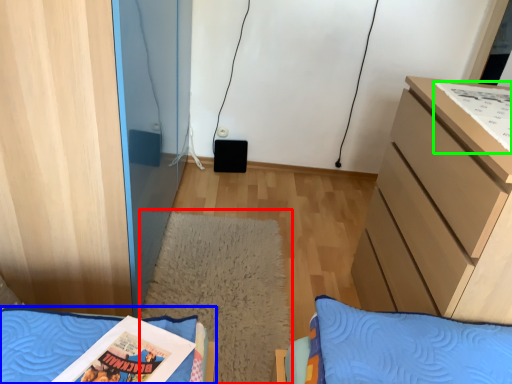
Question: Based on their relative distances, which object is farther from mat (highlighted by a red box)? Choose from furniture (highlighted by a blue box) and comic book (highlighted by a green box).

Choices:
 (A) furniture
 (B) comic book

Answer: (B)